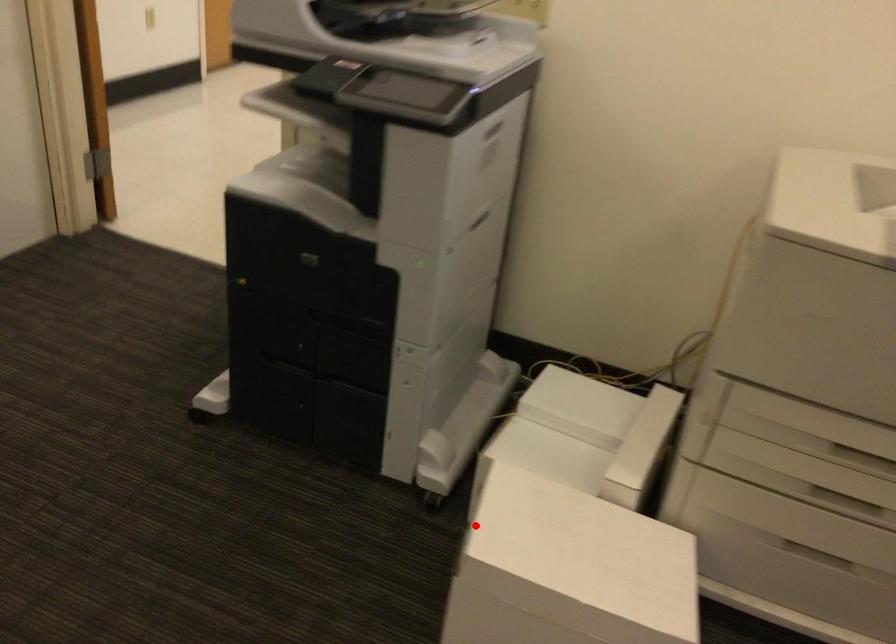
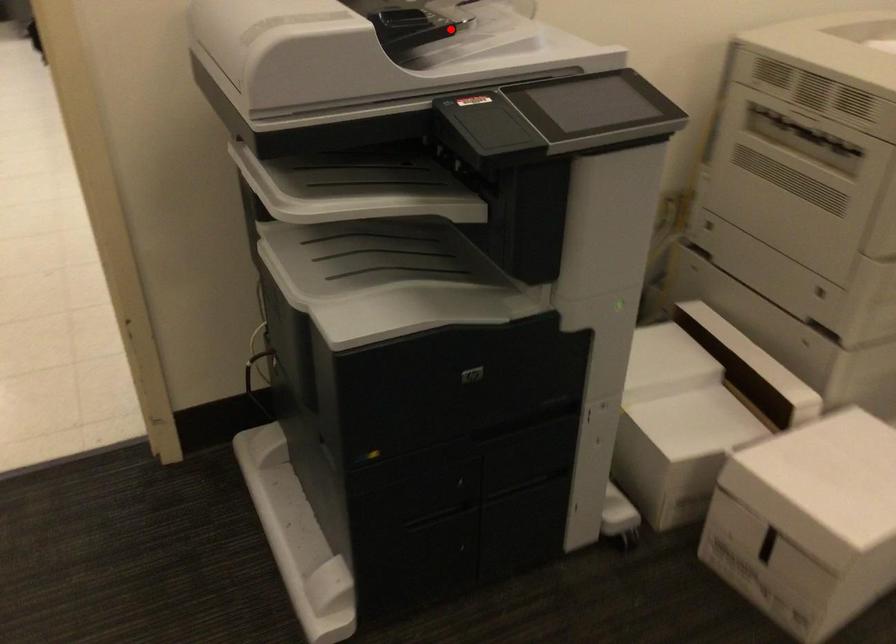
I am providing you with two images of the same scene from different viewpoints. A red point is marked on the first image and another point is marked on the second image. Is the red point in image1 aligned with the point shown in image2?

No